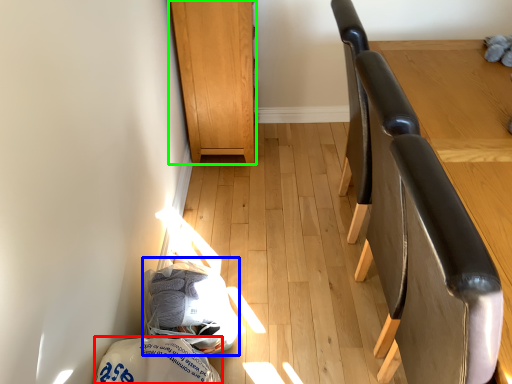
Question: Which object is the closest to the material (highlighted by a red box)? Choose among these: material (highlighted by a blue box) or furniture (highlighted by a green box).

Choices:
 (A) material
 (B) furniture

Answer: (A)